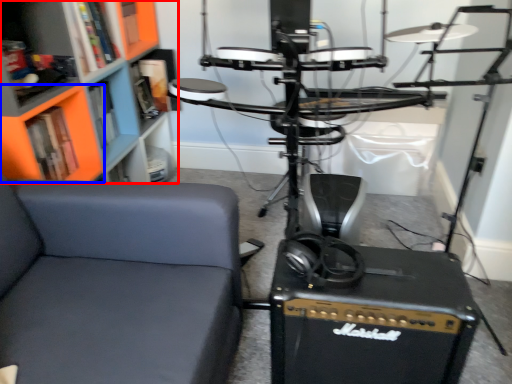
Question: Which object is closer to the camera taking this photo, bookcase (highlighted by a red box) or shelf (highlighted by a blue box)?

Choices:
 (A) bookcase
 (B) shelf

Answer: (A)